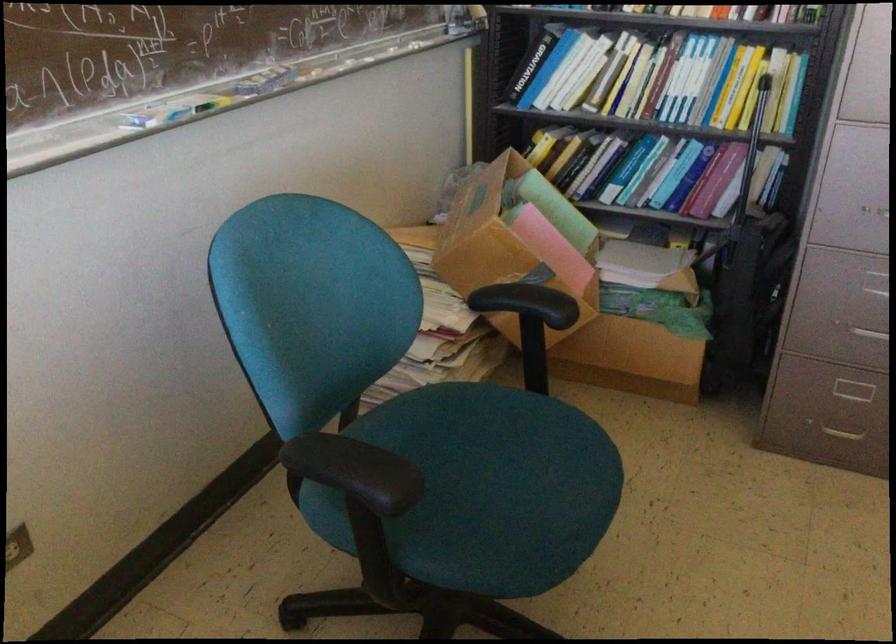
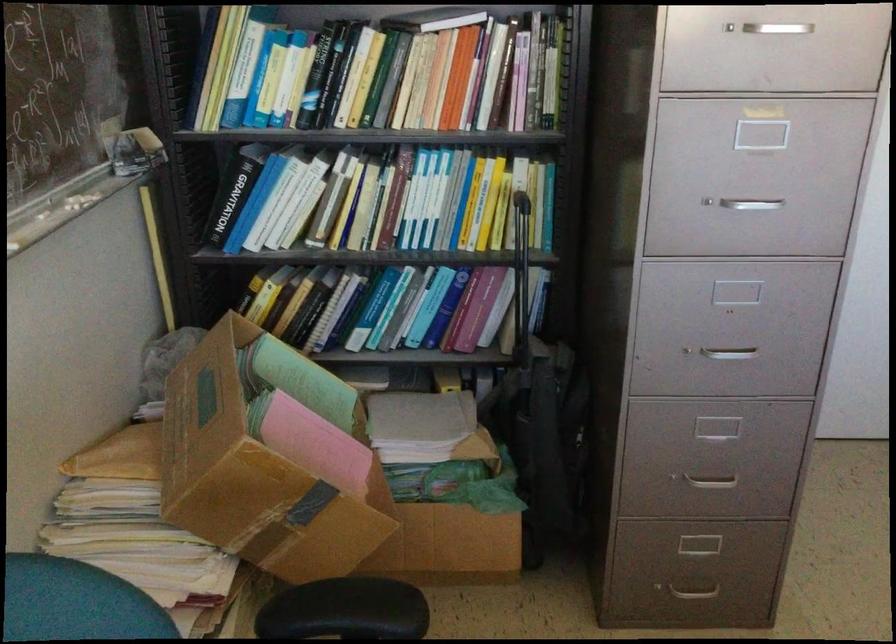
Question: The first image is from the beginning of the video and the second image is from the end. How did the camera likely rotate when shooting the video?

Choices:
 (A) Left
 (B) Right
 (C) Up
 (D) Down

Answer: (B)